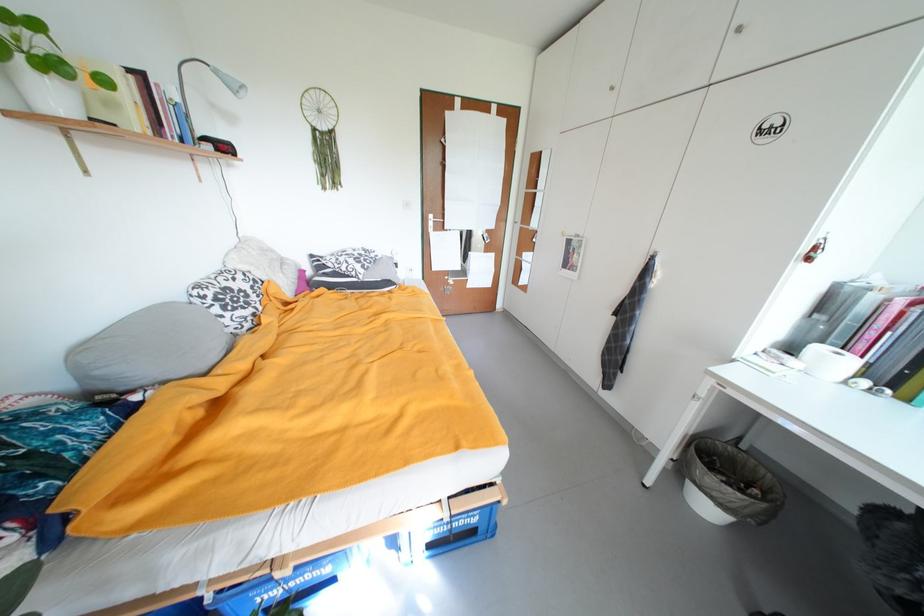
The location [829,362] corresponds to which object?

This point indicates the white tape roll.